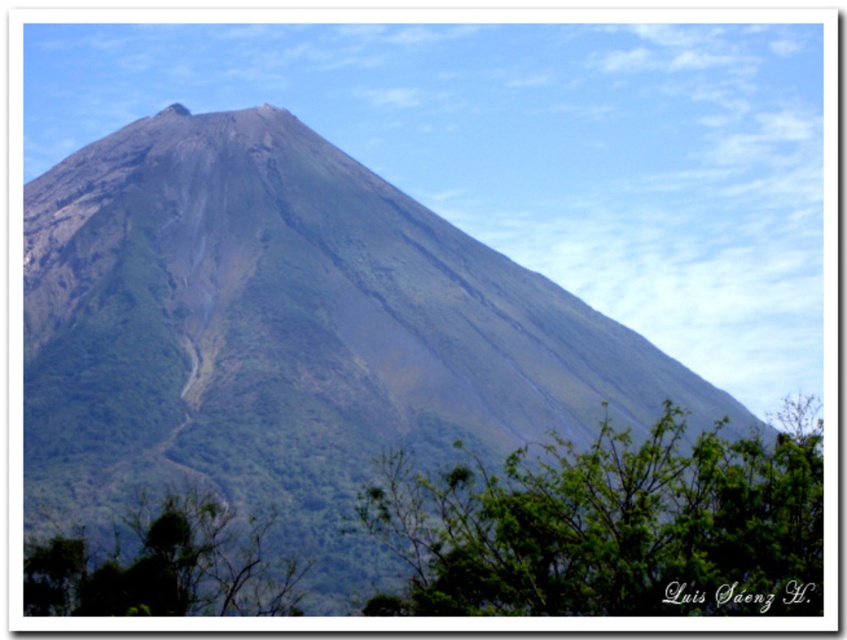
Is green rock mountain at center above green leafy tree at lower center?

Indeed, green rock mountain at center is positioned over green leafy tree at lower center.

Does point (303, 461) come in front of point (413, 513)?

No.

The image size is (847, 640). Find the location of `green rock mountain at center`. green rock mountain at center is located at coordinates (291, 333).

Does green rock mountain at center have a smaller size compared to green leafy tree at lower left?

No.

The width and height of the screenshot is (847, 640). Identify the location of green rock mountain at center. (291, 333).

Consider the image. Which of these two, green leafy tree at lower center or green leafy tree at lower left, stands taller?

Standing taller between the two is green leafy tree at lower center.

Can you confirm if green leafy tree at lower center is thinner than green leafy tree at lower left?

No.

Between point (495, 531) and point (253, 552), which one is positioned in front?

Positioned in front is point (495, 531).

What are the coordinates of `green leafy tree at lower center` in the screenshot? It's located at (x=609, y=525).